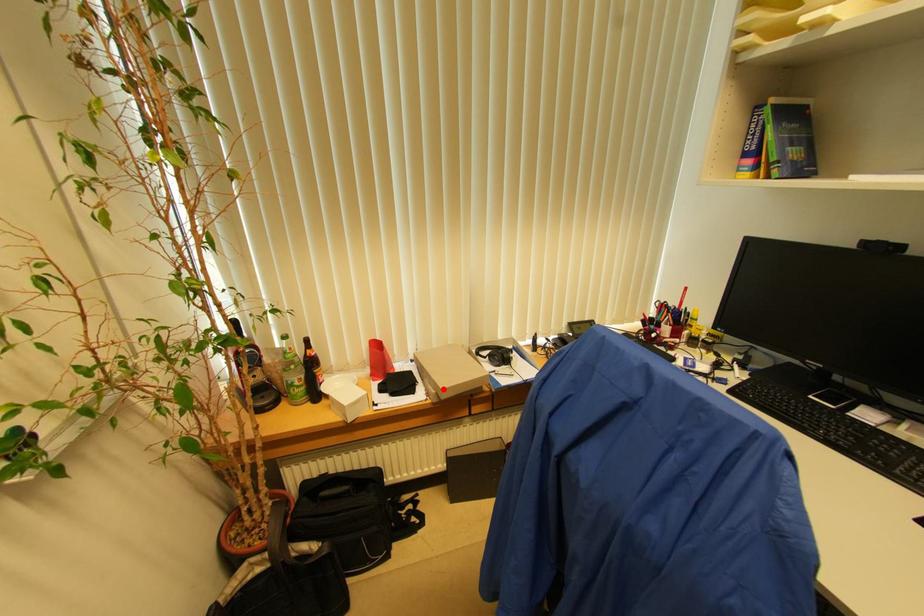
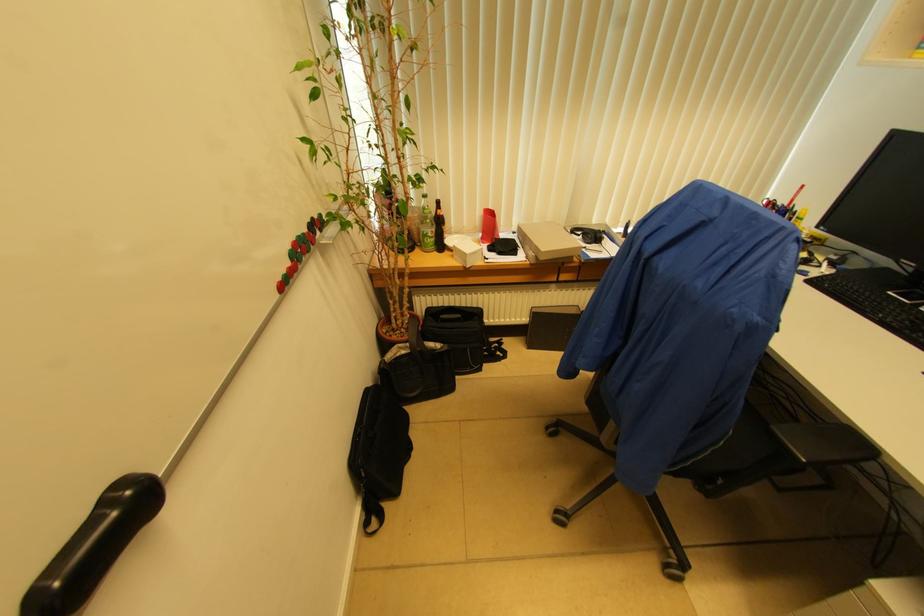
Find the pixel in the second image that matches the highlighted location in the first image.

(543, 252)